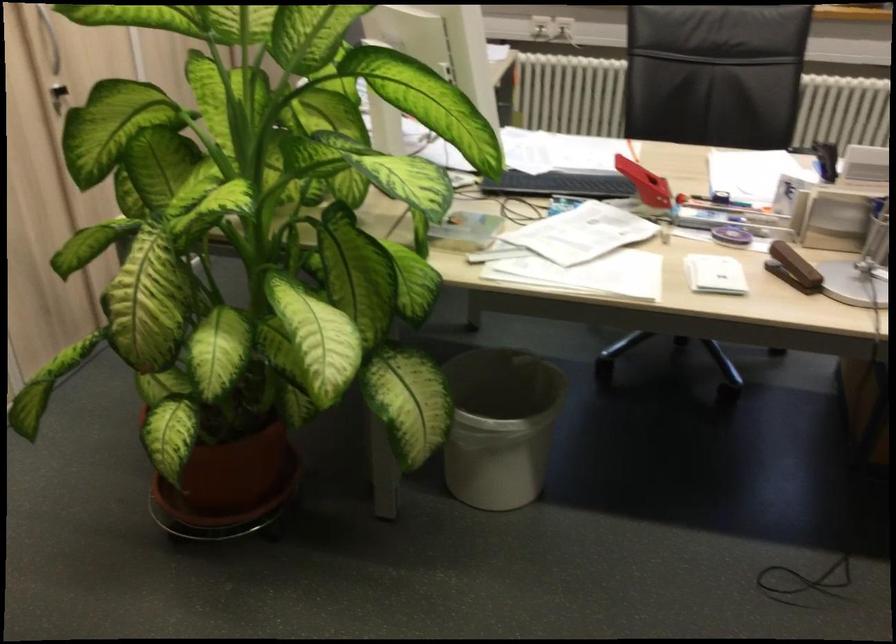
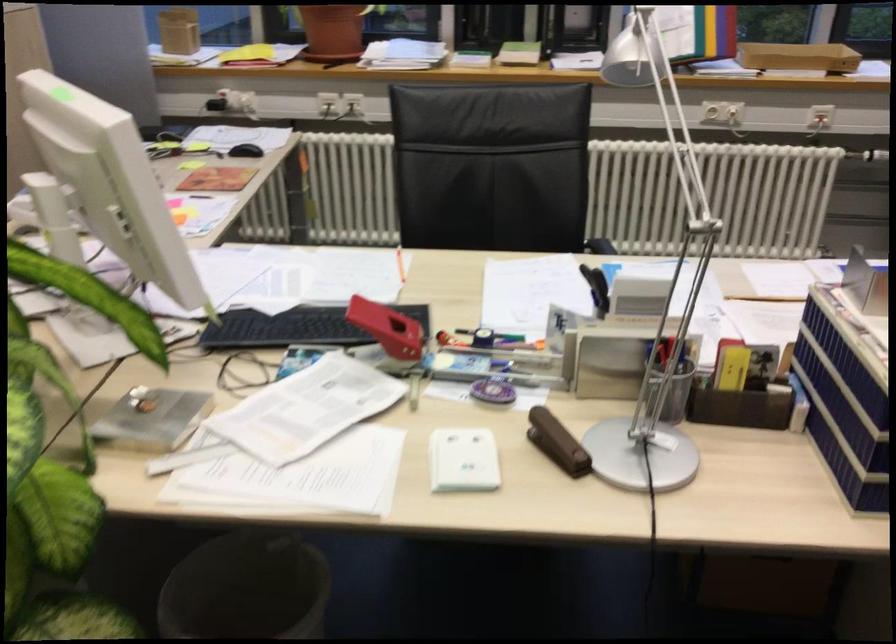
What movement of the cameraman would produce the second image?

The movement direction of the cameraman is right, forward.